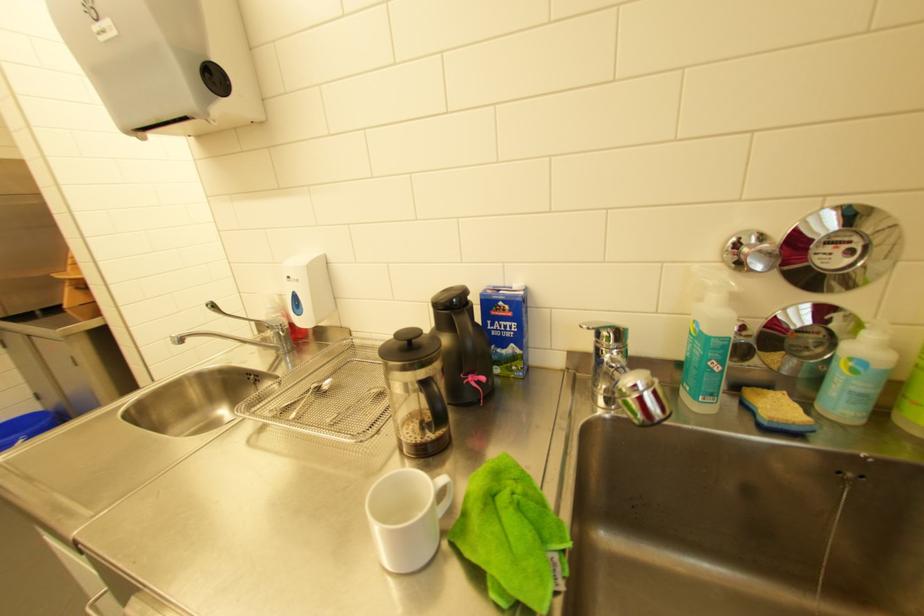
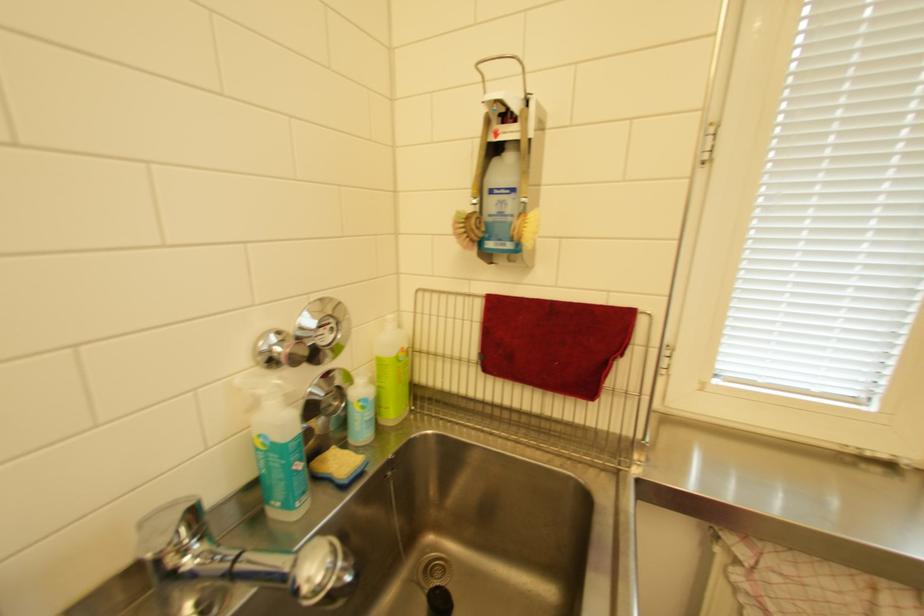
Find the pixel in the second image that matches (730,371) in the first image.

(312, 467)